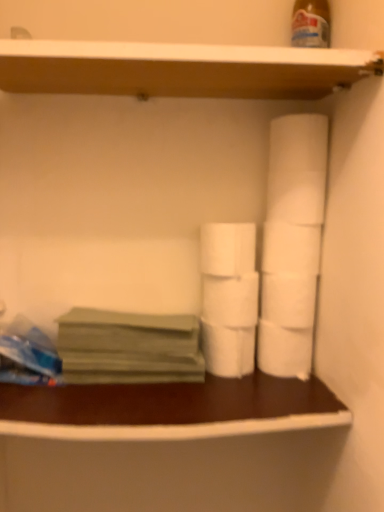
Question: Which direction should I rotate to look at white matte toilet paper at center, positioned as the 5th toilet paper in top-to-bottom order, — up or down?

Choices:
 (A) up
 (B) down

Answer: (B)

Question: Can you confirm if white matte toilet paper at right, placed as the 4th toilet paper when sorted from top to bottom, is positioned to the right of brown wood counter at lower center?

Choices:
 (A) yes
 (B) no

Answer: (A)

Question: Can brown wood counter at lower center be found inside white matte toilet paper at right, placed as the 4th toilet paper when sorted from top to bottom?

Choices:
 (A) no
 (B) yes

Answer: (A)

Question: From the image's perspective, is white matte toilet paper at right, placed as the 4th toilet paper when sorted from top to bottom, located above brown wood counter at lower center?

Choices:
 (A) yes
 (B) no

Answer: (A)

Question: Considering the relative sizes of white matte toilet paper at right, placed as the 4th toilet paper when sorted from top to bottom, and brown wood counter at lower center in the image provided, is white matte toilet paper at right, placed as the 4th toilet paper when sorted from top to bottom, shorter than brown wood counter at lower center?

Choices:
 (A) yes
 (B) no

Answer: (B)

Question: Does white matte toilet paper at right, positioned as the 3th toilet paper in bottom-to-top order, have a smaller size compared to brown wood counter at lower center?

Choices:
 (A) yes
 (B) no

Answer: (A)

Question: Is white matte toilet paper at right, positioned as the 3th toilet paper in bottom-to-top order, wider than brown wood counter at lower center?

Choices:
 (A) yes
 (B) no

Answer: (B)

Question: From the image's perspective, does wooden at upper center appear lower than white matte toilet paper at right, positioned as the 3th toilet paper in bottom-to-top order?

Choices:
 (A) no
 (B) yes

Answer: (A)

Question: Is wooden at upper center not close to white matte toilet paper at right, placed as the 4th toilet paper when sorted from top to bottom?

Choices:
 (A) yes
 (B) no

Answer: (B)

Question: Does wooden at upper center touch white matte toilet paper at right, positioned as the 3th toilet paper in bottom-to-top order?

Choices:
 (A) no
 (B) yes

Answer: (A)

Question: Does wooden at upper center appear on the left side of white matte toilet paper at right, placed as the 4th toilet paper when sorted from top to bottom?

Choices:
 (A) yes
 (B) no

Answer: (A)

Question: From a real-world perspective, is wooden at upper center on white matte toilet paper at right, positioned as the 3th toilet paper in bottom-to-top order?

Choices:
 (A) yes
 (B) no

Answer: (A)

Question: Does wooden at upper center turn towards white matte toilet paper at right, placed as the 4th toilet paper when sorted from top to bottom?

Choices:
 (A) no
 (B) yes

Answer: (A)

Question: Does wooden at upper center have a lesser width compared to green matte paper at left?

Choices:
 (A) no
 (B) yes

Answer: (A)